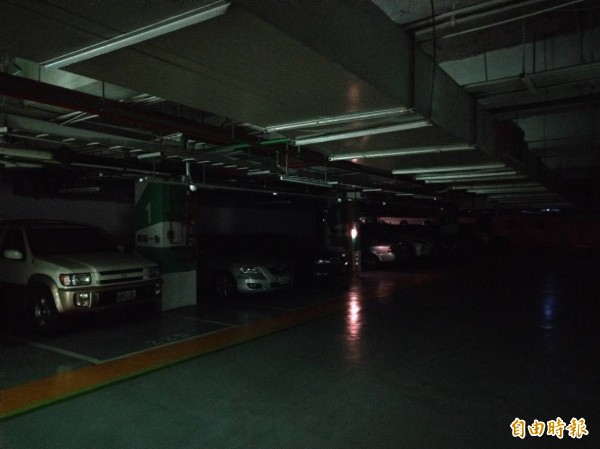
Find the location of a particular element. The height and width of the screenshot is (449, 600). small light is located at coordinates (353, 228).